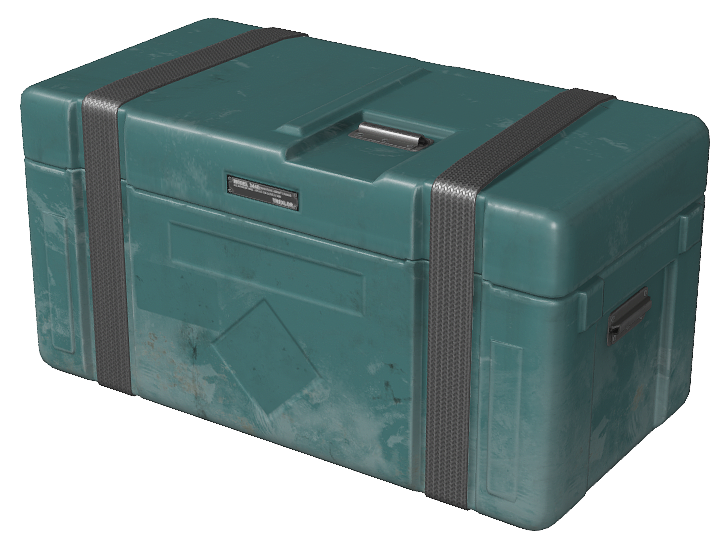
Where is `bracket`? The image size is (728, 548). bracket is located at coordinates (389, 140), (632, 311).